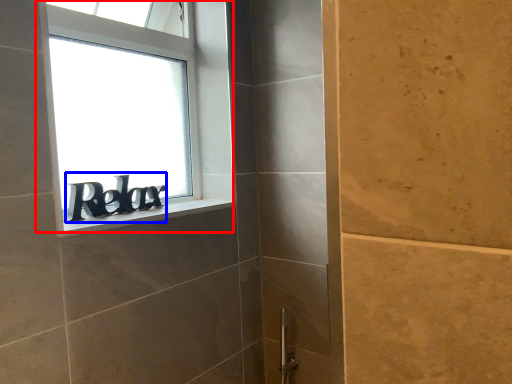
Question: Which point is further to the camera, window (highlighted by a red box) or writing (highlighted by a blue box)?

Choices:
 (A) window
 (B) writing

Answer: (B)